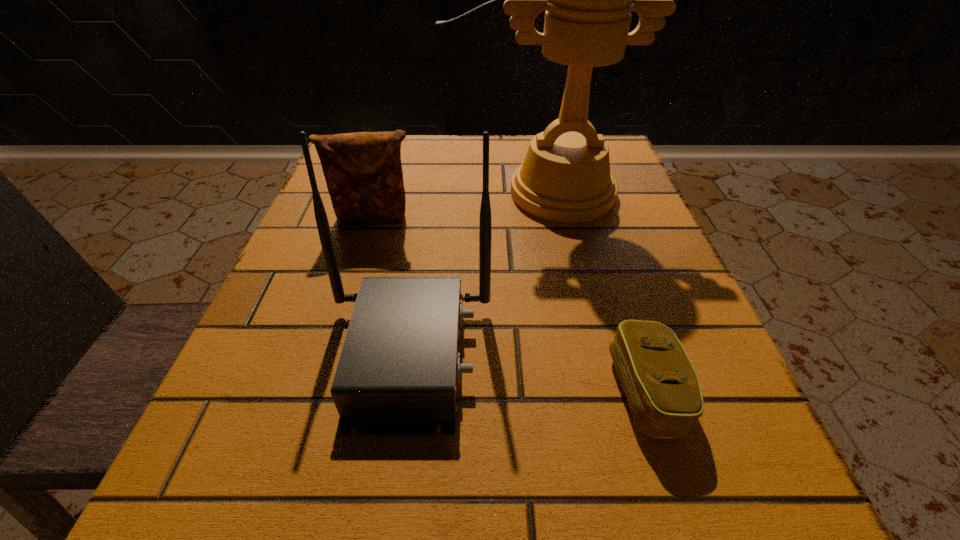
Locate an element on the screen. free space at the right edge is located at coordinates (603, 298).

This screenshot has height=540, width=960. In order to click on vacant space at the far left corner in this screenshot , I will do (x=404, y=145).

Find the location of a particular element. vacant space at the near left corner is located at coordinates (223, 501).

Find the location of a particular element. free space at the far right corner of the desktop is located at coordinates (613, 138).

Find the location of a particular element. This screenshot has width=960, height=540. empty location between the shorter clutch bag and the second tallest object is located at coordinates (527, 373).

The height and width of the screenshot is (540, 960). In order to click on vacant space in between the nearer clutch bag and the second tallest object in this screenshot , I will do `click(527, 373)`.

This screenshot has width=960, height=540. What are the coordinates of `vacant point located between the farther clutch bag and the award` in the screenshot? It's located at (x=468, y=206).

The height and width of the screenshot is (540, 960). I want to click on blank region between the router and the nearer clutch bag, so click(527, 373).

This screenshot has width=960, height=540. In order to click on unoccupied position between the tallest object and the left clutch bag in this screenshot , I will do `click(468, 206)`.

Find the location of a particular element. vacant region between the nearer clutch bag and the third shortest object is located at coordinates point(527,373).